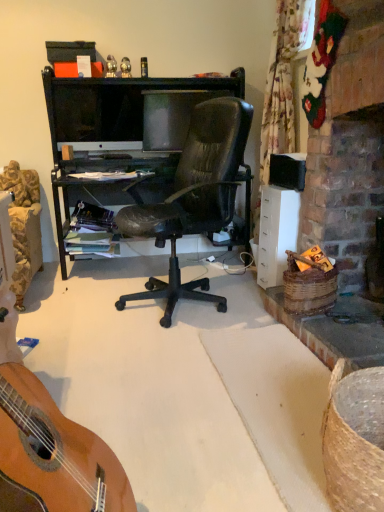
Question: Can you confirm if brown woven picnic basket at right, the 2th picnic basket ordered from the bottom, is shorter than brown woven picnic basket at lower right, the 1th picnic basket from the front?

Choices:
 (A) no
 (B) yes

Answer: (B)

Question: Considering the relative positions of brown woven picnic basket at right, the first picnic basket when ordered from top to bottom, and brown woven picnic basket at lower right, which ranks as the 2th picnic basket in back-to-front order, in the image provided, is brown woven picnic basket at right, the first picnic basket when ordered from top to bottom, in front of brown woven picnic basket at lower right, which ranks as the 2th picnic basket in back-to-front order,?

Choices:
 (A) no
 (B) yes

Answer: (A)

Question: Is brown woven picnic basket at right, the second picnic basket from the front, outside of brown woven picnic basket at lower right, the 1th picnic basket from the front?

Choices:
 (A) yes
 (B) no

Answer: (A)

Question: Would you consider brown woven picnic basket at right, the first picnic basket when ordered from top to bottom, to be distant from brown woven picnic basket at lower right, the 1th picnic basket from the front?

Choices:
 (A) no
 (B) yes

Answer: (A)

Question: Is the depth of brown woven picnic basket at right, the second picnic basket from the front, greater than that of brown woven picnic basket at lower right, which ranks as the 2th picnic basket in back-to-front order?

Choices:
 (A) no
 (B) yes

Answer: (B)

Question: Is brown woven picnic basket at right, the first picnic basket when ordered from top to bottom, oriented away from brown woven picnic basket at lower right, the 1th picnic basket from the front?

Choices:
 (A) yes
 (B) no

Answer: (B)

Question: Can you confirm if brown woven picnic basket at right, the second picnic basket from the front, is smaller than matte black monitor at center, marked as the first television in a right-to-left arrangement?

Choices:
 (A) no
 (B) yes

Answer: (B)

Question: Is matte black monitor at center, marked as the first television in a right-to-left arrangement, a part of brown woven picnic basket at right, marked as the first picnic basket in a back-to-front arrangement?

Choices:
 (A) yes
 (B) no

Answer: (B)

Question: Is brown woven picnic basket at right, the second picnic basket from the front, positioned before matte black monitor at center, which is the second television in left-to-right order?

Choices:
 (A) yes
 (B) no

Answer: (A)

Question: From a real-world perspective, is brown woven picnic basket at right, marked as the first picnic basket in a back-to-front arrangement, under matte black monitor at center, marked as the first television in a right-to-left arrangement?

Choices:
 (A) no
 (B) yes

Answer: (B)

Question: Does brown woven picnic basket at right, the first picnic basket when ordered from top to bottom, have a greater width compared to matte black monitor at center, marked as the first television in a right-to-left arrangement?

Choices:
 (A) no
 (B) yes

Answer: (B)

Question: Considering the relative sizes of brown woven picnic basket at right, the 2th picnic basket ordered from the bottom, and matte black monitor at center, marked as the first television in a right-to-left arrangement, in the image provided, is brown woven picnic basket at right, the 2th picnic basket ordered from the bottom, shorter than matte black monitor at center, marked as the first television in a right-to-left arrangement,?

Choices:
 (A) yes
 (B) no

Answer: (A)

Question: Does matte black box at upper center appear on the right side of matte black monitor at center, which is the second television in left-to-right order?

Choices:
 (A) no
 (B) yes

Answer: (A)